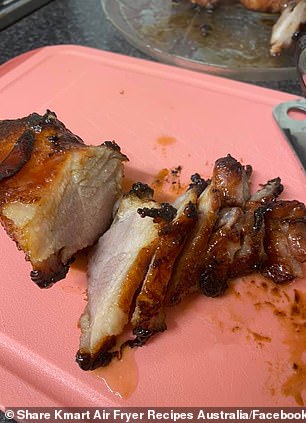
The width and height of the screenshot is (306, 423). Identify the location of tray. (x=159, y=142).